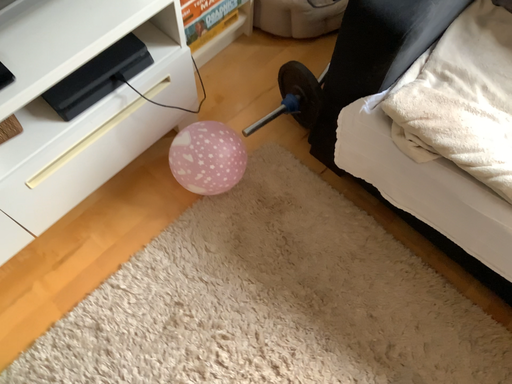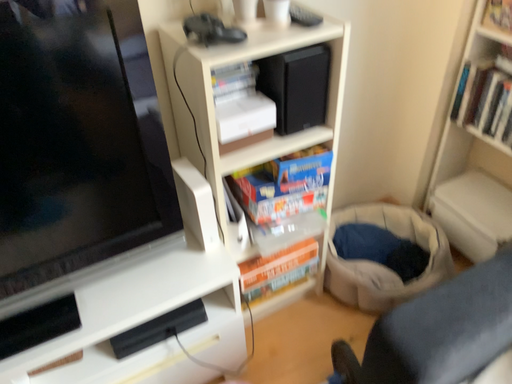
Question: Which way did the camera rotate in the video?

Choices:
 (A) rotated downward
 (B) rotated upward

Answer: (B)